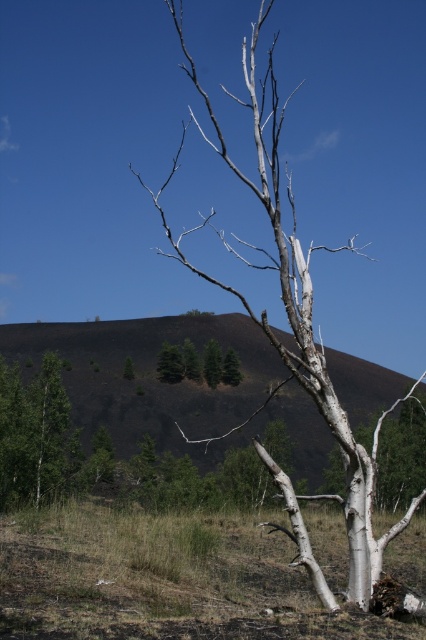
Can you confirm if burnt soil at center is positioned above green matte trees at center?

Actually, burnt soil at center is below green matte trees at center.

Is burnt soil at center thinner than green matte trees at center?

Incorrect, burnt soil at center's width is not less than green matte trees at center's.

Is point (135, 365) positioned before point (215, 381)?

No, (135, 365) is behind (215, 381).

Where is `burnt soil at center`? The image size is (426, 640). burnt soil at center is located at coordinates (170, 385).

Does white bark birch tree at center appear on the left side of green matte trees at center?

No, white bark birch tree at center is not to the left of green matte trees at center.

Measure the distance from white bark birch tree at center to green matte trees at center.

26.51 meters

Where is `white bark birch tree at center`? white bark birch tree at center is located at coordinates (293, 326).

Between burnt soil at center and white bark birch tree at center, which one is positioned lower?

burnt soil at center is lower down.

Which of these two, burnt soil at center or white bark birch tree at center, stands shorter?

burnt soil at center

Where is `burnt soil at center`? This screenshot has width=426, height=640. burnt soil at center is located at coordinates (170, 385).

Where is `burnt soil at center`? burnt soil at center is located at coordinates (170, 385).